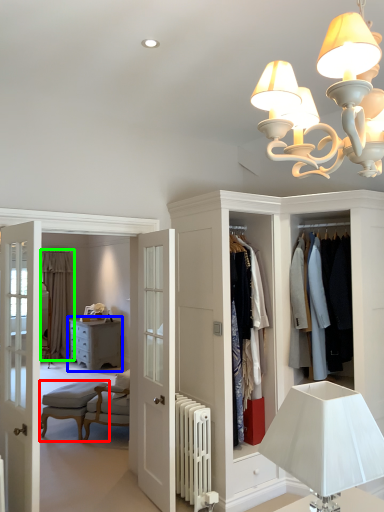
Question: Considering the real-world distances, which object is closest to armchair (highlighted by a red box)? chest of drawers (highlighted by a blue box) or curtain (highlighted by a green box).

Choices:
 (A) chest of drawers
 (B) curtain

Answer: (A)